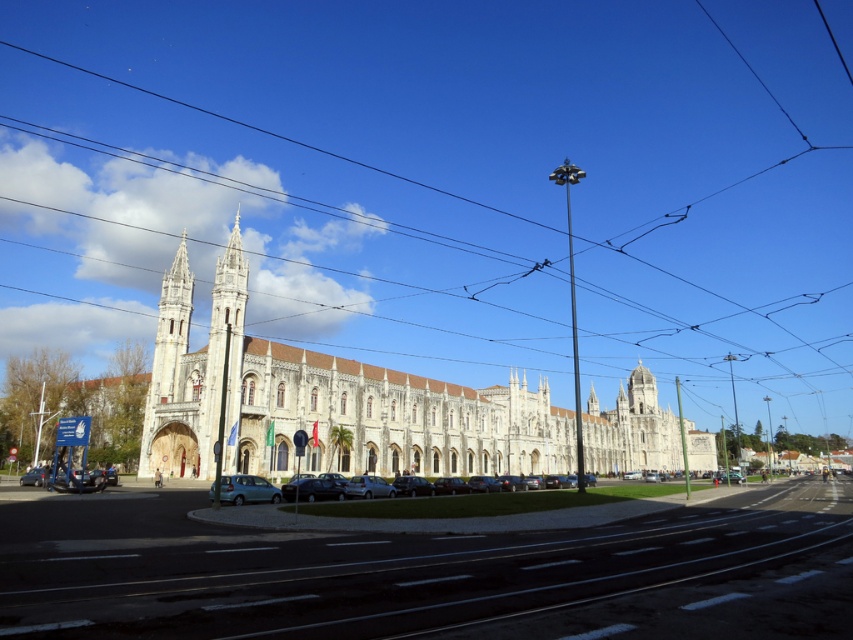
Question: Which of the following is the closest to the observer?

Choices:
 (A) (219, 388)
 (B) (270, 493)
 (C) (515, 209)
 (D) (175, 285)

Answer: (B)

Question: Which of the following is the farthest from the observer?

Choices:
 (A) black wire at upper center
 (B) white stone church at center
 (C) teal matte car at lower left

Answer: (A)

Question: From the image, what is the correct spatial relationship of white stone church at center in relation to white stone tower at center-left?

Choices:
 (A) left
 (B) right

Answer: (B)

Question: Can you confirm if white stone church at center is bigger than teal matte car at lower left?

Choices:
 (A) no
 (B) yes

Answer: (B)

Question: In this image, where is black wire at upper center located relative to white stone church at center?

Choices:
 (A) below
 (B) above

Answer: (B)

Question: Among these points, which one is farthest from the camera?

Choices:
 (A) (451, 212)
 (B) (229, 467)
 (C) (216, 323)

Answer: (A)